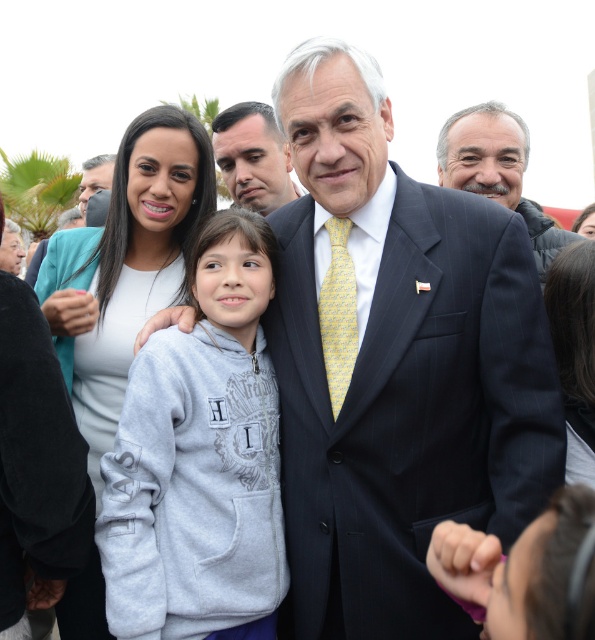
You are a photographer at the event and want to take a photo of the matte black face at left and the yellow printed tie at center. To ensure both are in frame, should you adjust your camera to focus more to the left or the right?

The yellow printed tie at center is to the right of matte black face at left, so you should focus more to the right to include both in the frame.

You are a photographer at the event and want to ensure both the dark blue pinstripe suit at center and the yellow printed tie at center are clearly visible in your photo. Given their sizes, which one might require closer framing to capture detail?

The dark blue pinstripe suit at center is larger in size than the yellow printed tie at center, so the yellow printed tie at center may need closer framing to ensure its details are visible.

You are standing at point (x=324, y=289) and want to move to point (x=286, y=166). Based on the scene description, will you have to walk towards the palm trees in the distance?

Yes, because point (x=286, y=166) is behind point (x=324, y=289), so moving from point (x=324, y=289) to point (x=286, y=166) would require walking towards the palm trees in the distance.